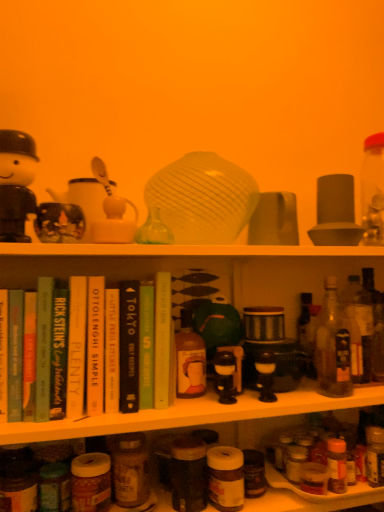
Find the location of a particular element. The image size is (384, 512). free space in front of hardcover book at center, the 5th book in the left-to-right sequence is located at coordinates (152, 409).